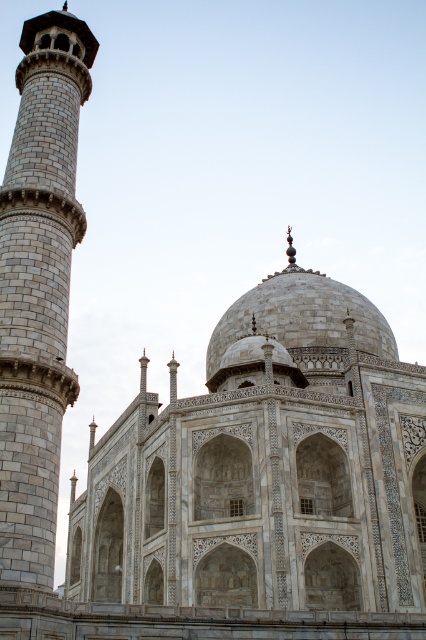
You are standing in front of the Taj Mahal and notice two points marked on the structure. The first point is at coordinates point (x=85, y=90) and the second is at point (x=393, y=355). Which of these points is nearer to your current position?

Point (x=85, y=90) is closer to the camera than point (x=393, y=355), so the first point is nearer to your current position.

You are standing in front of the Taj Mahal and notice two structures. One is the white marble tower at left and the other is the white marble dome at center. Which of these two structures is positioned more to the east if the Taj Mah Mahal faces west?

The white marble tower at left is positioned more to the east because it is to the left of the white marble dome at center, and since the Taj Mahal faces west, left would correspond to the east direction.

Based on the scene description of the Taj Mahal, where is the white marble tower at left located in terms of coordinates?

The white marble tower at left is located at coordinates point (39, 288).